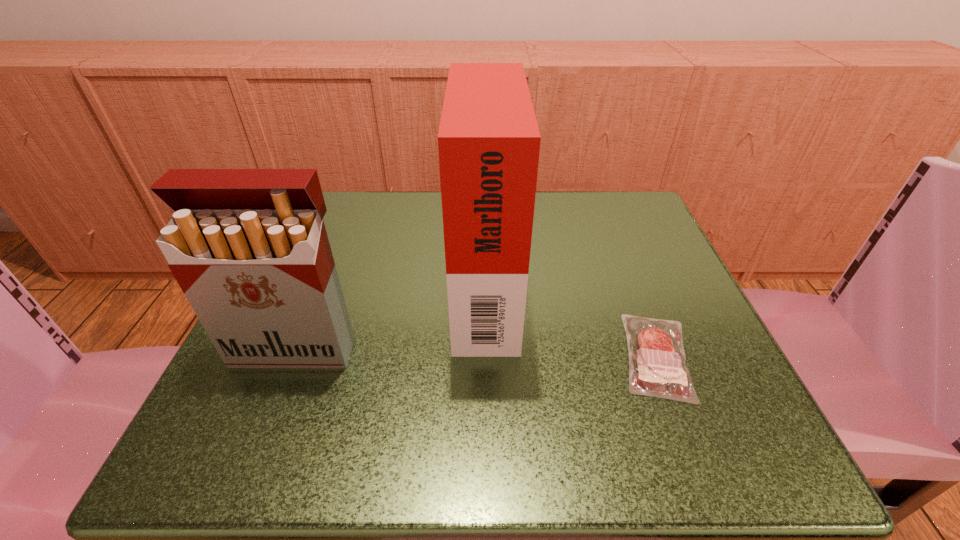
This screenshot has width=960, height=540. Identify the location of the tallest object. click(x=488, y=141).

The width and height of the screenshot is (960, 540). In order to click on the taller cigarette case in this screenshot , I will do `click(488, 141)`.

Where is `the leftmost object`? This screenshot has width=960, height=540. the leftmost object is located at coordinates (248, 247).

The width and height of the screenshot is (960, 540). I want to click on the left cigarette case, so click(x=248, y=247).

Image resolution: width=960 pixels, height=540 pixels. I want to click on the shortest object, so [657, 363].

Where is `steak`? steak is located at coordinates (657, 363).

You are a GUI agent. You are given a task and a screenshot of the screen. Output one action in this format:
    pyautogui.click(x=<x>, y=<y>)
    Task: Click on the vacant space located 0.150m on the front-facing side of the taller cigarette case
    Image resolution: width=960 pixels, height=540 pixels.
    Given the screenshot: What is the action you would take?
    pyautogui.click(x=374, y=285)

Locate an element on the screen. vacant space located 0.130m on the front-facing side of the taller cigarette case is located at coordinates (385, 285).

Identify the location of vacant space situated on the front-facing side of the taller cigarette case. (363, 285).

This screenshot has height=540, width=960. What are the coordinates of `free spot located with the lid open on the shorter cigarette case` in the screenshot? It's located at (265, 422).